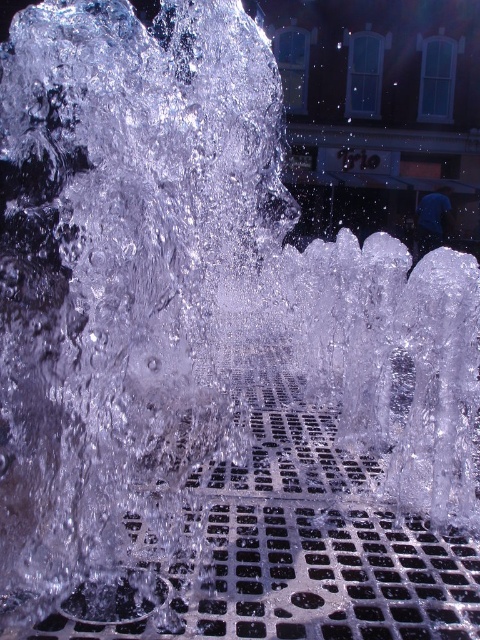
Describe the element at coordinates (292, 547) in the screenshot. I see `metallic grid at center` at that location.

Between metallic grid at center and metallic grid at lower center, which one appears on the right side from the viewer's perspective?

Positioned to the right is metallic grid at center.

You are a GUI agent. You are given a task and a screenshot of the screen. Output one action in this format:
    pyautogui.click(x=<x>, y=<y>)
    Task: Click on the metallic grid at center
    This screenshot has height=640, width=480.
    Given the screenshot: What is the action you would take?
    pyautogui.click(x=292, y=547)